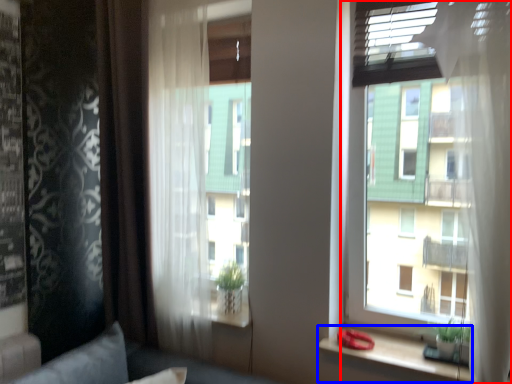
Question: Which point is further to the camera, window (highlighted by a red box) or window sill (highlighted by a blue box)?

Choices:
 (A) window
 (B) window sill

Answer: (B)